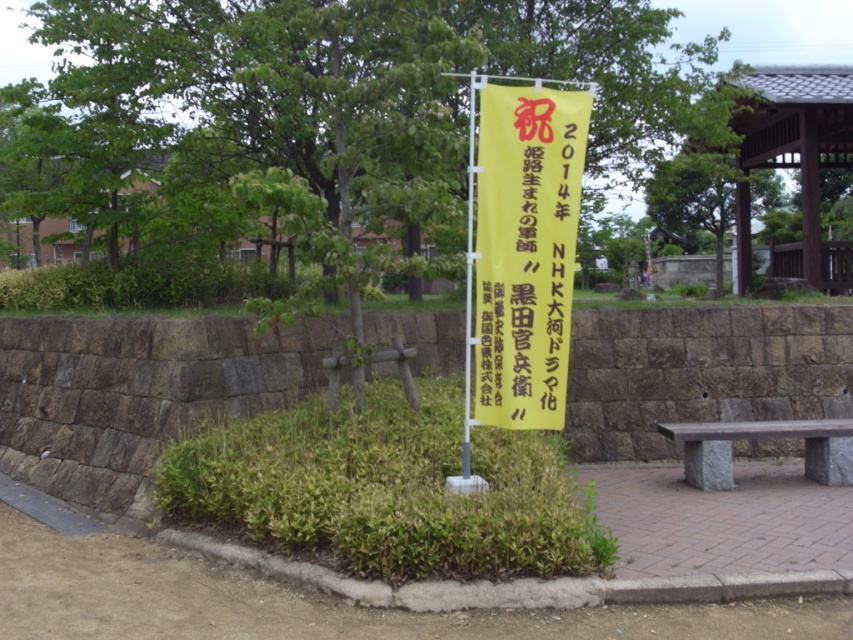
You are standing at the entrance of the park and see the yellow paper banner at center. Can you determine its exact position based on the coordinates provided?

The yellow paper banner at center is located at point (525, 252) in the image coordinates.

You are a visitor in the park and want to take a photo of both the green leafy tree at center and the yellow paper banner at center. Which object should you frame first in your camera to ensure both are in the shot?

The green leafy tree at center is positioned on the left side of the yellow paper banner at center, so you should frame the green leafy tree at center first to ensure both are in the shot.